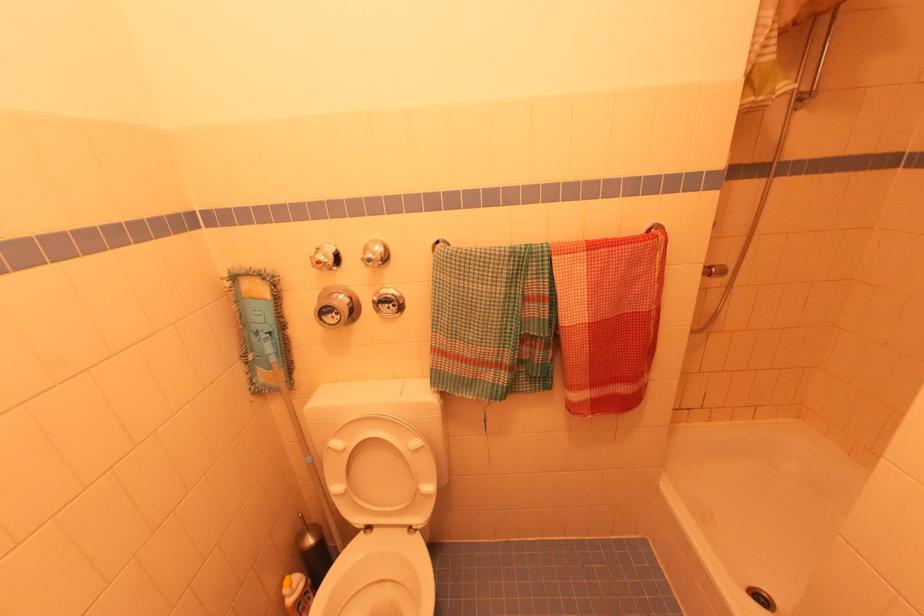
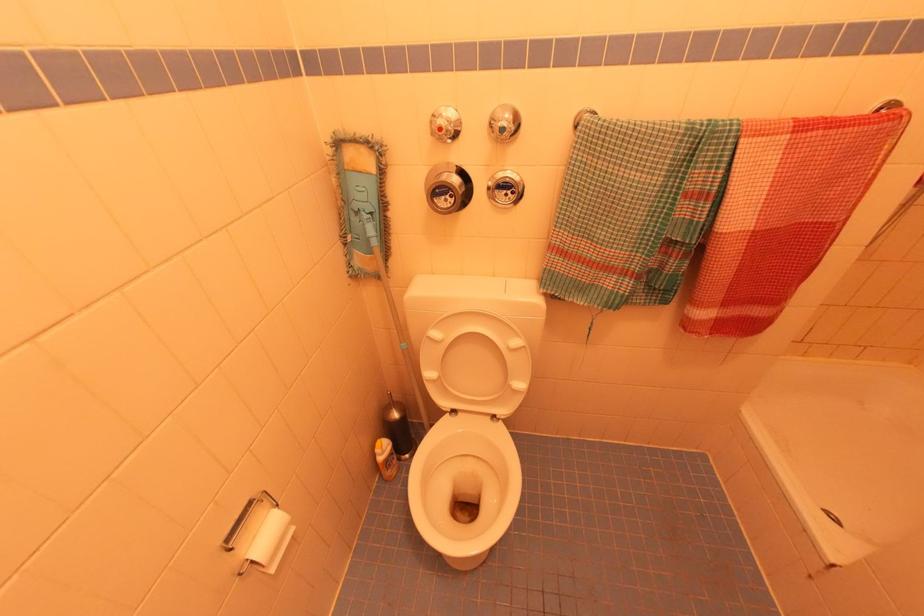
In the second image, find the point that corresponds to point (600, 243) in the first image.

(812, 122)